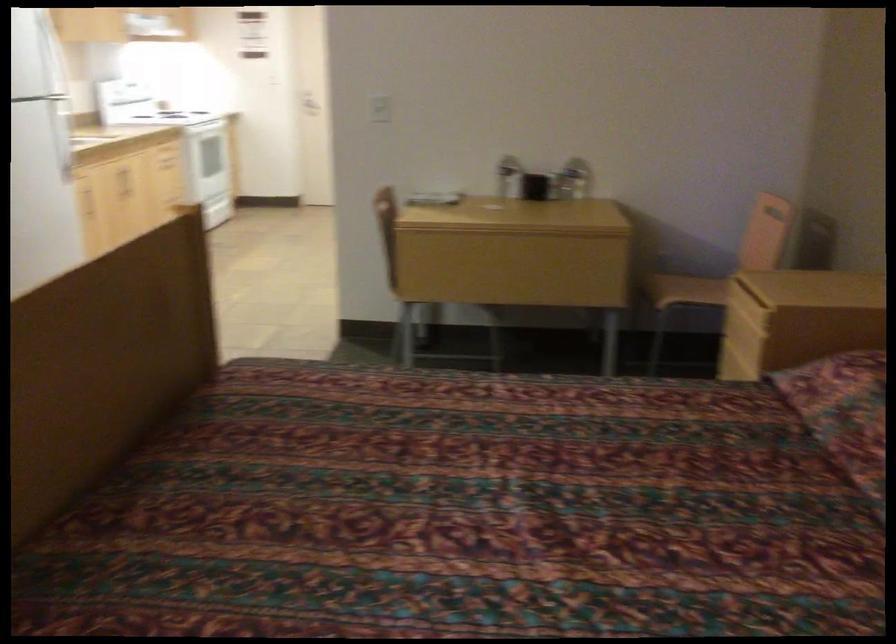
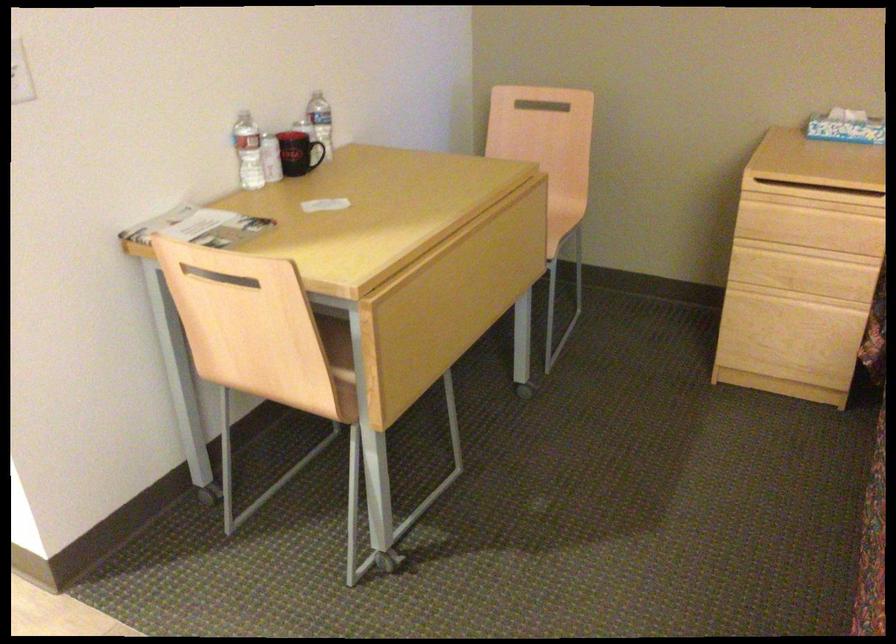
Find the pixel in the second image that matches [455,279] in the first image.

(338, 357)